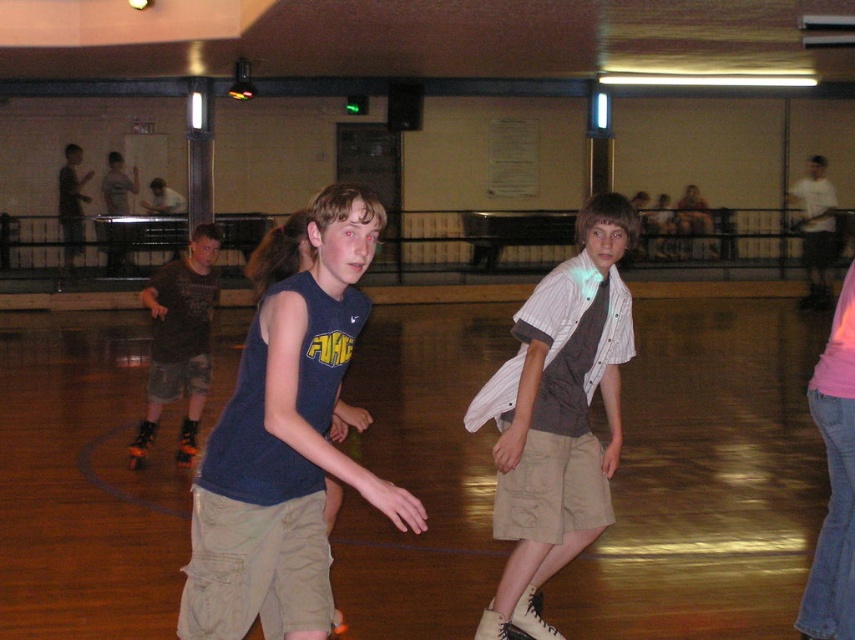
Does striped cotton shirt at center appear on the right side of camouflage shorts at left?

Yes, striped cotton shirt at center is to the right of camouflage shorts at left.

Between striped cotton shirt at center and camouflage shorts at left, which one is positioned lower?

striped cotton shirt at center is lower down.

The width and height of the screenshot is (855, 640). Describe the element at coordinates (558, 408) in the screenshot. I see `striped cotton shirt at center` at that location.

Where is `striped cotton shirt at center`? This screenshot has width=855, height=640. striped cotton shirt at center is located at coordinates (558, 408).

Does point (517, 620) lie behind point (140, 451)?

No, (517, 620) is in front of (140, 451).

Between white matte roller skate at lower center and orange roller skate at lower left, which one appears on the left side from the viewer's perspective?

From the viewer's perspective, orange roller skate at lower left appears more on the left side.

Looking at this image, who is more forward, (544, 630) or (142, 452)?

Point (544, 630) is in front.

What are the coordinates of `white matte roller skate at lower center` in the screenshot? It's located at (529, 620).

How much distance is there between striped cotton shirt at center and white matte roller skate at lower center?

They are 23.45 inches apart.

Identify the location of striped cotton shirt at center. Image resolution: width=855 pixels, height=640 pixels. (558, 408).

Does point (553, 493) lie in front of point (513, 620)?

Yes.

Identify the location of striped cotton shirt at center. This screenshot has height=640, width=855. (558, 408).